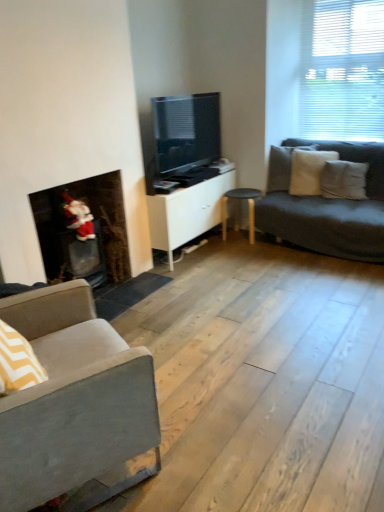
Question: Looking at the image, does white blinds at upper right seem bigger or smaller compared to white soft pillow at right, which is the third pillow in left-to-right order?

Choices:
 (A) big
 (B) small

Answer: (A)

Question: Choose the correct answer: Is white blinds at upper right inside white soft pillow at right, which is the third pillow in left-to-right order, or outside it?

Choices:
 (A) outside
 (B) inside

Answer: (A)

Question: Considering the real-world distances, which object is closest to the white blinds at upper right?

Choices:
 (A) gray fabric pillow at right, which is the 3th pillow from right to left
 (B) white cotton pillow at right, which is the second pillow in right-to-left order
 (C) matte black tv at center
 (D) black wood stool at center
 (E) white matte cabinet at center

Answer: (B)

Question: Which object is the farthest from the white soft pillow at right, which is the third pillow in left-to-right order?

Choices:
 (A) white matte cabinet at center
 (B) black wood stool at center
 (C) gray fabric pillow at right, which is the 3th pillow from right to left
 (D) gray fabric couch at left
 (E) matte black tv at center

Answer: (D)